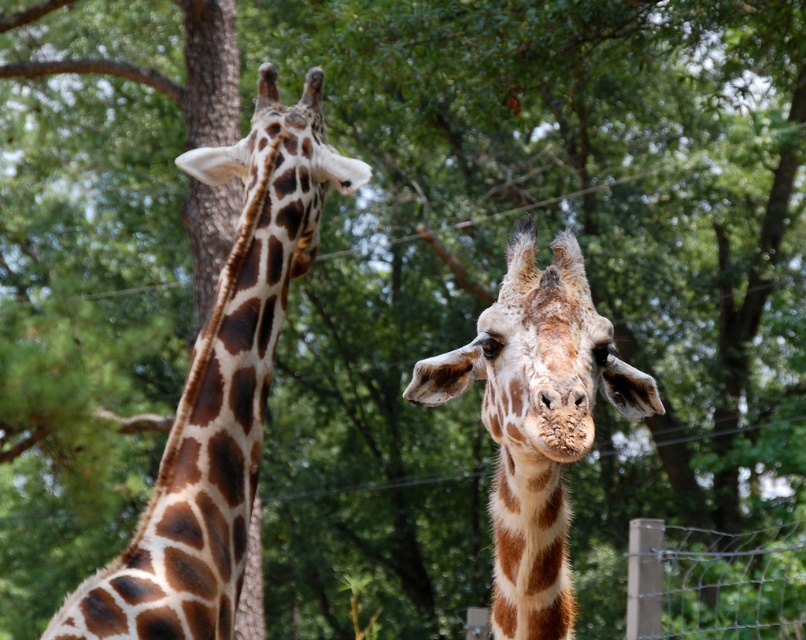
You are a zookeeper who needs to ensure the giraffes can see each other across the enclosure. Given the brown spotted giraffe at left and the wire mesh fence at lower right, which object is taller and might block the view?

The brown spotted giraffe at left is much taller than the wire mesh fence at lower right, so the fence is unlikely to block their view.

You are a zookeeper observing two giraffes in their enclosure. You notice the brown spotted giraffe at left and the brown spotted giraffe at center. Which giraffe has a wider body?

The brown spotted giraffe at left has a wider body than the brown spotted giraffe at center.

You are a zookeeper who needs to ensure the brown spotted giraffe at center stays within the enclosure. The enclosure is bordered by the wire mesh fence at lower right. Based on the image, is the giraffe currently inside the enclosure?

The brown spotted giraffe at center is located above the wire mesh fence at lower right, which means it is outside the enclosure. The zookeeper should guide it back inside.